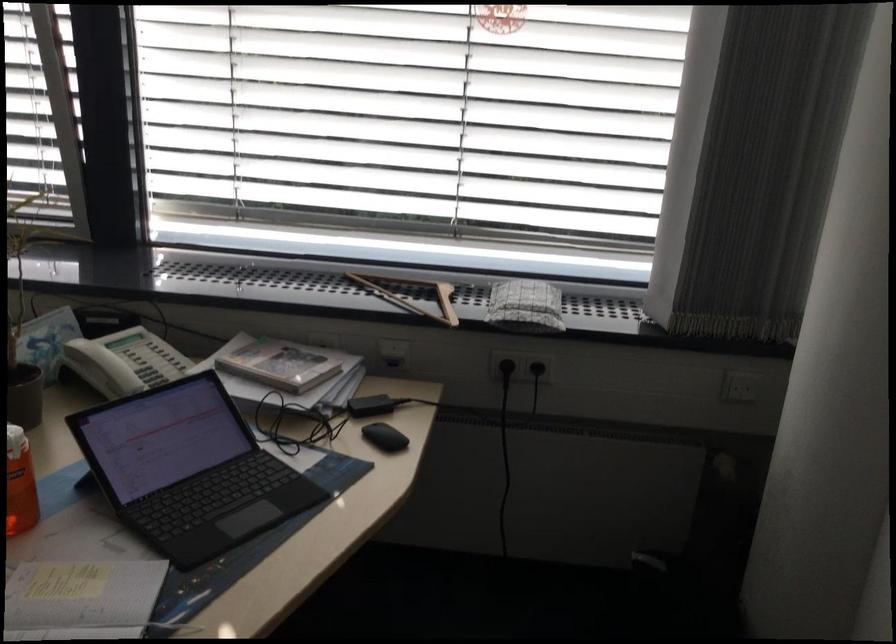
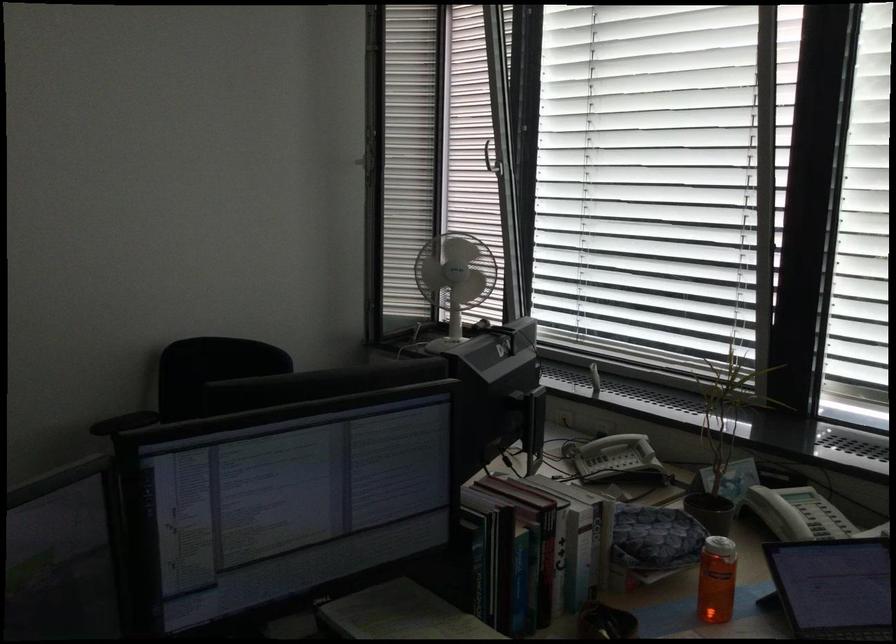
The point at (124, 368) is marked in the first image. Where is the corresponding point in the second image?

(797, 514)